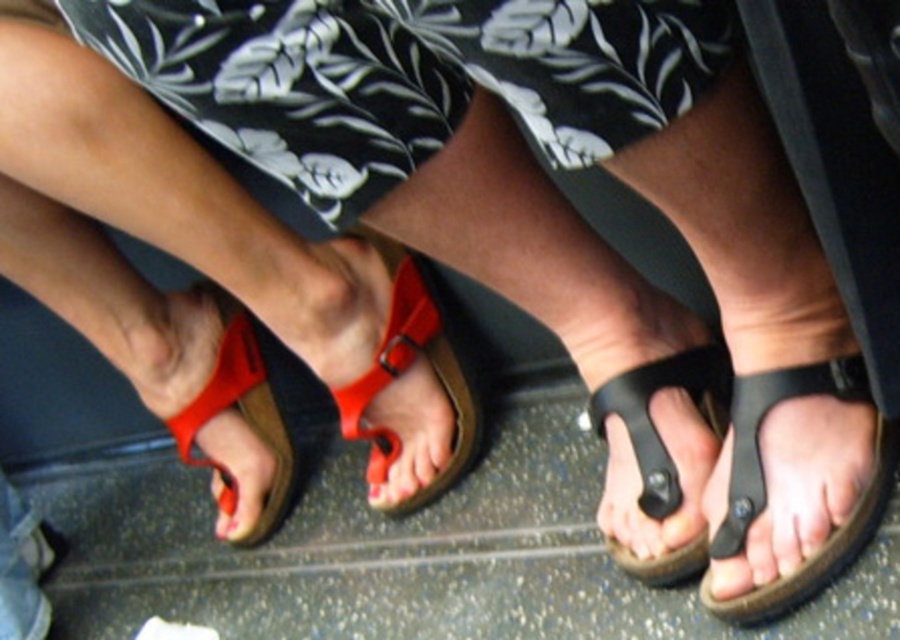
Can you confirm if black rubber sandal at lower right is wider than rubber matte flip-flop at center?

No.

Between black rubber sandal at lower right and rubber matte flip-flop at center, which one has more height?

Standing taller between the two is rubber matte flip-flop at center.

Which is in front, point (759, 372) or point (387, 362)?

Positioned in front is point (759, 372).

The width and height of the screenshot is (900, 640). In order to click on black rubber sandal at lower right in this screenshot , I will do `click(758, 433)`.

Is black rubber sandal at center taller than rubber matte flip-flop at center?

No, black rubber sandal at center is not taller than rubber matte flip-flop at center.

Between black rubber sandal at center and rubber matte flip-flop at center, which one appears on the left side from the viewer's perspective?

Positioned to the left is rubber matte flip-flop at center.

Does point (682, 364) come behind point (364, 374)?

That is False.

Where is `black rubber sandal at center`? black rubber sandal at center is located at coordinates (659, 458).

Is black rubber sandal at center shorter than black rubber sandal at lower right?

No, black rubber sandal at center is not shorter than black rubber sandal at lower right.

Does black rubber sandal at center have a greater height compared to black rubber sandal at lower right?

Correct, black rubber sandal at center is much taller as black rubber sandal at lower right.

Does point (684, 349) lie behind point (850, 540)?

Yes, point (684, 349) is behind point (850, 540).

Locate an element on the screen. This screenshot has height=640, width=900. black rubber sandal at center is located at coordinates (659, 458).